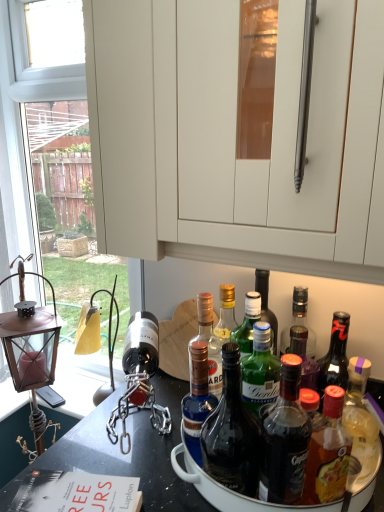
Question: Looking at their shapes, would you say translucent glass bottle at center, the third bottle from the right, is wider or thinner than blue glass bottle at center, which is the 1th bottle from left to right?

Choices:
 (A) wide
 (B) thin

Answer: (A)

Question: In terms of height, does translucent glass bottle at center, the third bottle in the left-to-right sequence, look taller or shorter compared to blue glass bottle at center, which appears as the 5th bottle when viewed from the right?

Choices:
 (A) tall
 (B) short

Answer: (A)

Question: Which is farther from the blue glass bottle at center, acting as the fourth bottle starting from the right?

Choices:
 (A) translucent plastic bottle at lower right, which is the fifth bottle from left to right
 (B) blue glass bottle at center, which appears as the 5th bottle when viewed from the right
 (C) translucent glass bottle at center, which appears as the fourth bottle when viewed from the left
 (D) bronze lantern at left
 (E) translucent glass bottle at center, the third bottle from the right

Answer: (D)

Question: Which of these objects is positioned closest to the blue glass bottle at center, the 2th bottle when ordered from left to right?

Choices:
 (A) bronze lantern at left
 (B) blue glass bottle at center, which appears as the 5th bottle when viewed from the right
 (C) translucent plastic bottle at lower right, which is the fifth bottle from left to right
 (D) translucent glass bottle at center, the third bottle from the right
 (E) translucent glass bottle at center, which is the 2th bottle from right to left

Answer: (B)